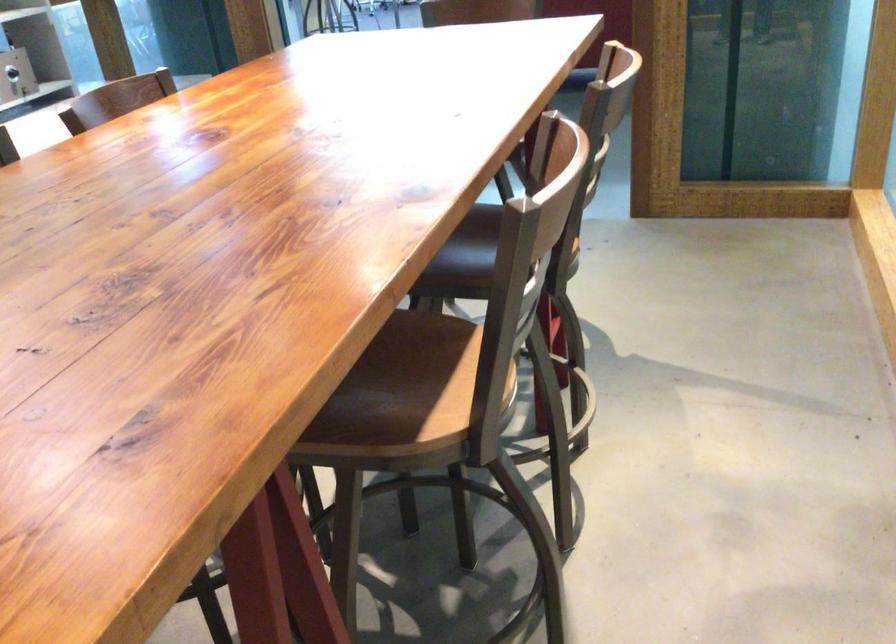
First-person continuous shooting, in which direction is the camera rotating?

The camera rotated toward right-up.